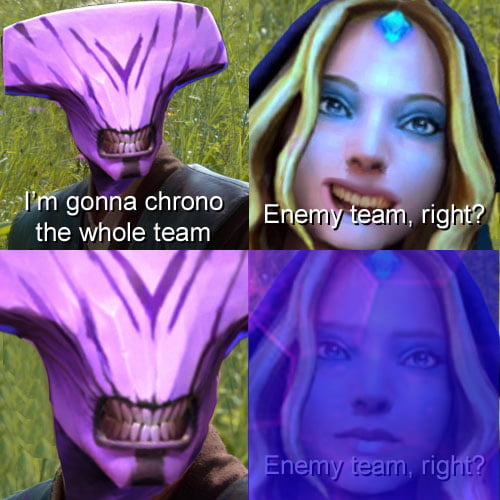
Where is `hood`? This screenshot has height=500, width=500. hood is located at coordinates (489, 98), (484, 321).